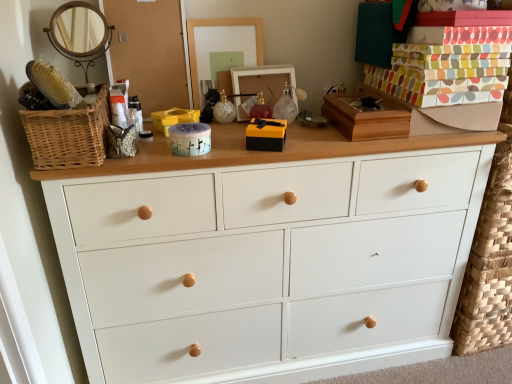
In order to click on free space above wooden box at center, the 3th box from the left (from a real-world perspective) in this screenshot , I will do tap(364, 105).